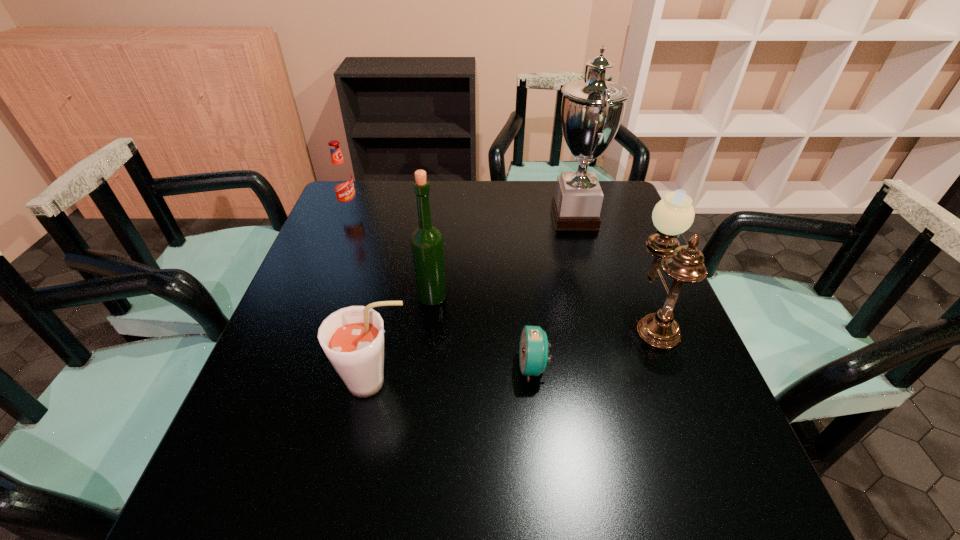
The image size is (960, 540). In order to click on free space located at the front view of the tallest object in this screenshot , I will do `click(474, 217)`.

Where is `vacant space located 0.270m on the left of the liquor`? Image resolution: width=960 pixels, height=540 pixels. vacant space located 0.270m on the left of the liquor is located at coordinates (308, 297).

This screenshot has height=540, width=960. I want to click on vacant space located on the back of the oil lamp, so click(x=616, y=227).

I want to click on vacant space situated 0.180m on the front of the leftmost object, so click(332, 251).

Identify the location of free spot located on the drink side of the right root beer. (569, 382).

I want to click on vacant area situated 0.070m on the front-facing side of the third object from right to left, so click(x=486, y=367).

Image resolution: width=960 pixels, height=540 pixels. I want to click on blank area located on the front-facing side of the third object from right to left, so click(362, 367).

I want to click on free region located on the front-facing side of the third object from right to left, so click(x=396, y=367).

Where is `trophy cup at the far edge`? trophy cup at the far edge is located at coordinates (592, 110).

Image resolution: width=960 pixels, height=540 pixels. What are the coordinates of `root beer that is at the far edge` in the screenshot? It's located at (341, 177).